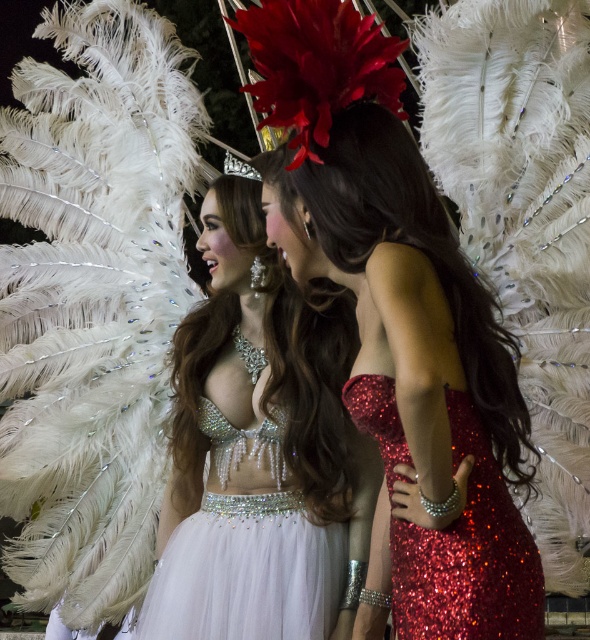
Which is more to the left, swarthy satin dress at center or shiny red dress at center?

swarthy satin dress at center

Which is in front, point (245, 182) or point (378, 211)?

Point (378, 211)

Locate an element on the screen. This screenshot has width=590, height=640. swarthy satin dress at center is located at coordinates (258, 449).

Which is more to the left, shiny red dress at center or sparkly red dress at center?

Positioned to the left is shiny red dress at center.

This screenshot has width=590, height=640. In order to click on shiny red dress at center in this screenshot , I will do `click(444, 298)`.

Between point (270, 177) and point (478, 560), which one is positioned in front?

Positioned in front is point (478, 560).

This screenshot has height=640, width=590. Identify the location of shiny red dress at center. (444, 298).

Between swarthy satin dress at center and sparkly red dress at center, which one appears on the right side from the viewer's perspective?

From the viewer's perspective, sparkly red dress at center appears more on the right side.

Between point (205, 634) and point (519, 625), which one is positioned in front?

Point (519, 625) is more forward.

What do you see at coordinates (258, 449) in the screenshot? I see `swarthy satin dress at center` at bounding box center [258, 449].

The width and height of the screenshot is (590, 640). What are the coordinates of `swarthy satin dress at center` in the screenshot? It's located at (258, 449).